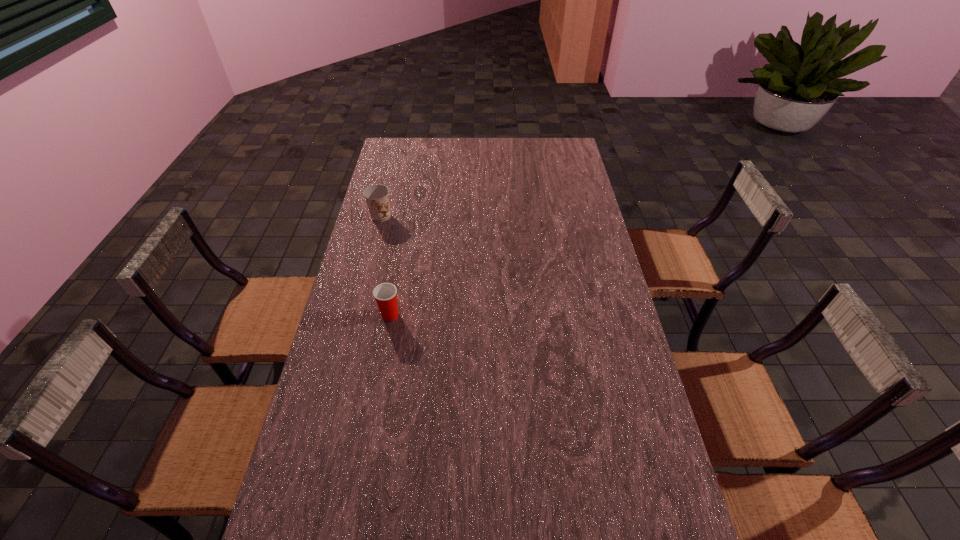
Find the location of a particular element. This screenshot has width=960, height=540. vacant space that's between the bigger white detergent and the leftmost detergent is located at coordinates (458, 260).

This screenshot has height=540, width=960. What are the coordinates of `empty space that is in between the leftmost object and the tallest detergent` in the screenshot? It's located at (443, 232).

Identify the location of unoccupied position between the smaller white detergent and the seventh farthest object. (584, 369).

The height and width of the screenshot is (540, 960). What are the coordinates of `object that is the second closest to the nearest object` in the screenshot? It's located at (504, 353).

Locate an element on the screen. The width and height of the screenshot is (960, 540). the third closest object to the nearest object is located at coordinates point(611,341).

You are a GUI agent. You are given a task and a screenshot of the screen. Output one action in this format:
    pyautogui.click(x=<x>, y=<y>)
    Task: Click on the detergent that is the second closest to the nearest detergent
    This screenshot has width=960, height=540.
    Given the screenshot: What is the action you would take?
    pyautogui.click(x=500, y=206)

Identify which detergent is the second nearest to the bigger white detergent. Please provide its 2D coordinates. Your answer should be formatted as a tuple, i.e. [(x, y)], where the tuple contains the x and y coordinates of a point satisfying the conditions above.

[(413, 251)]

Where is `blue detergent that is the second closest to the radio receiver`? blue detergent that is the second closest to the radio receiver is located at coordinates (611, 341).

Find the location of a particular element. This screenshot has height=540, width=960. blue detergent that is the third nearest to the shortest object is located at coordinates [467, 160].

This screenshot has height=540, width=960. In order to click on free region that satisfies the following two spatial constraints: 1. on the front side of the rightmost blue detergent; 2. on the left side of the right white detergent in this screenshot , I will do `click(594, 356)`.